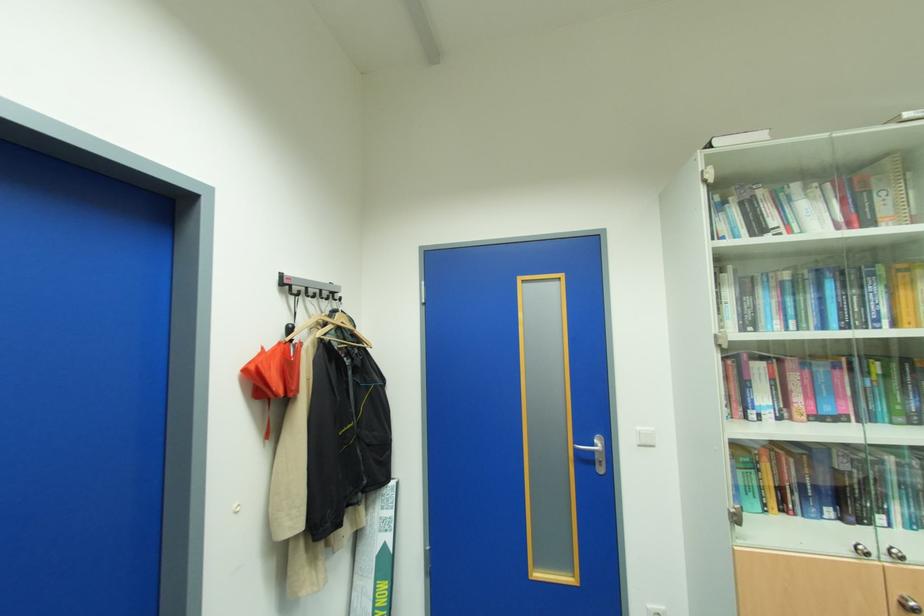
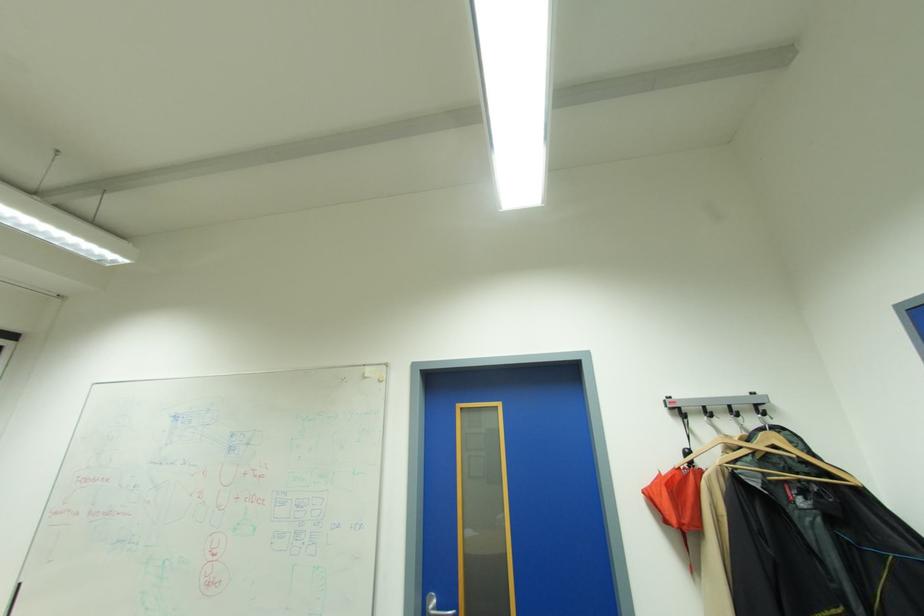
The first image is from the beginning of the video and the second image is from the end. How did the camera likely rotate when shooting the video?

The camera's rotation is toward left-up.